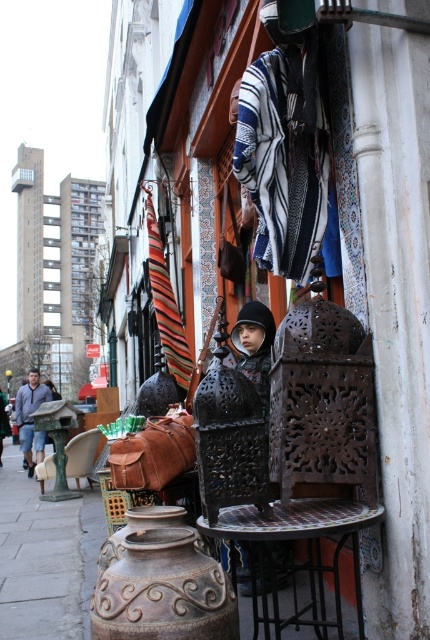
You are a customer at the shop and want to place a small package on the rustic metal table at center. Can the table support the package if the green fabric chair at center is nearby?

The rustic metal table at center is thinner than the green fabric chair at center, but the description does not provide information about the table strength or weight capacity. Therefore, it is unclear if the table can support the package.

Based on the photo, you are a customer at the shop and want to place a large decorative item on the rustic metal table at center. Considering the size of the green fabric chair at center, will the table be able to accommodate the item?

The rustic metal table at center is larger than the green fabric chair at center, so it should have enough space to accommodate a large decorative item.

You are a customer looking to purchase items from the shop. You see a denim jacket at left and a green fabric chair at center. Which item takes up more space in the store?

The denim jacket at left has a larger size compared to the green fabric chair at center, so it takes up more space in the store.